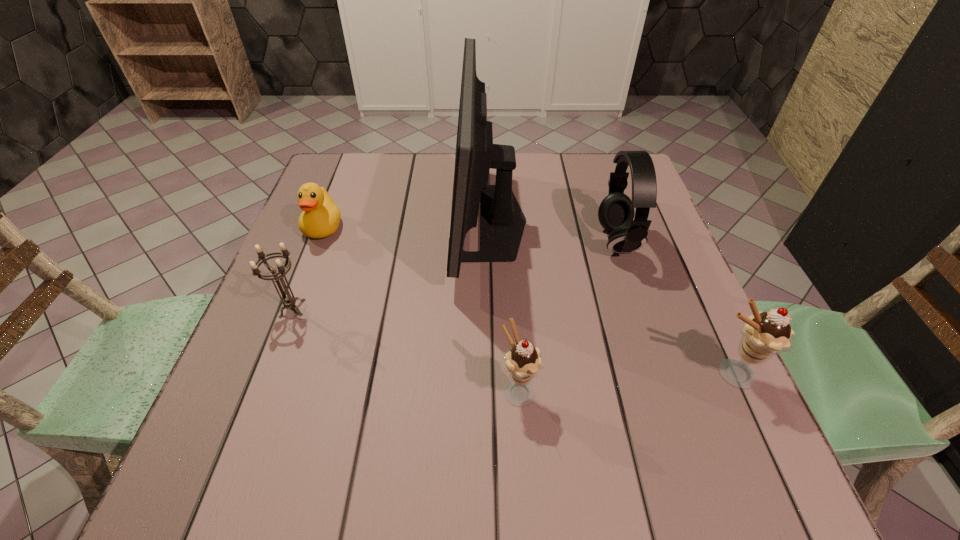
Locate an element on the screen. The width and height of the screenshot is (960, 540). icecream positioned at the right edge is located at coordinates (764, 334).

You are a GUI agent. You are given a task and a screenshot of the screen. Output one action in this format:
    pyautogui.click(x=<x>, y=<y>)
    Task: Click on the earphone at the right edge
    
    Given the screenshot: What is the action you would take?
    pyautogui.click(x=616, y=212)

This screenshot has height=540, width=960. What are the coordinates of `object present at the near right corner` in the screenshot? It's located at (764, 334).

At what (x,y) coordinates should I click in order to perform the action: click on vacant position at the far edge of the desktop. Please return your answer as a coordinate pair (x, y). The width and height of the screenshot is (960, 540). Looking at the image, I should click on (423, 167).

Find the location of a particular element. The height and width of the screenshot is (540, 960). vacant space at the near edge of the desktop is located at coordinates (524, 418).

This screenshot has height=540, width=960. I want to click on free space at the right edge, so click(676, 277).

Image resolution: width=960 pixels, height=540 pixels. In order to click on free space at the far left corner in this screenshot , I will do (376, 167).

In the image, there is a desktop. Where is `vacant space at the far right corner`? This screenshot has height=540, width=960. vacant space at the far right corner is located at coordinates (604, 165).

Locate an element on the screen. The height and width of the screenshot is (540, 960). free space at the near right corner is located at coordinates (671, 420).

Where is `vacant space that is in between the shortest object and the candle holder`? This screenshot has height=540, width=960. vacant space that is in between the shortest object and the candle holder is located at coordinates (308, 268).